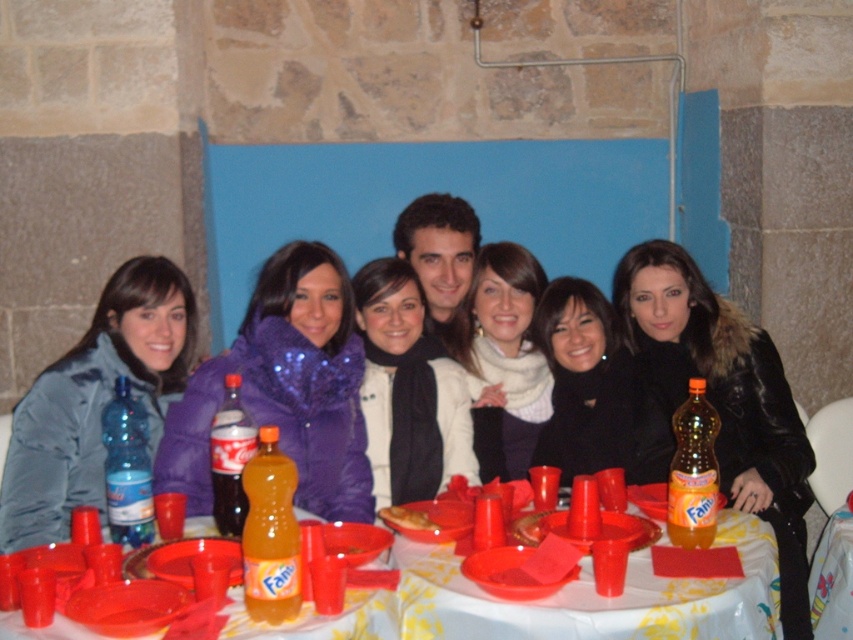
You are organizing a small event and need to decide seating arrangements. You have a narrow bench that can only accommodate items up to the width of the orange plastic bottle at center. Can the matte blue jacket at left fit on this bench?

The matte blue jacket at left is wider than the orange plastic bottle at center, so it cannot fit on the bench designed for items up to the width of the orange plastic bottle at center.

Based on the coordinates provided in the scene description, where exactly is the white knitwear at center positioned?

The white knitwear at center is located at point (503, 358).